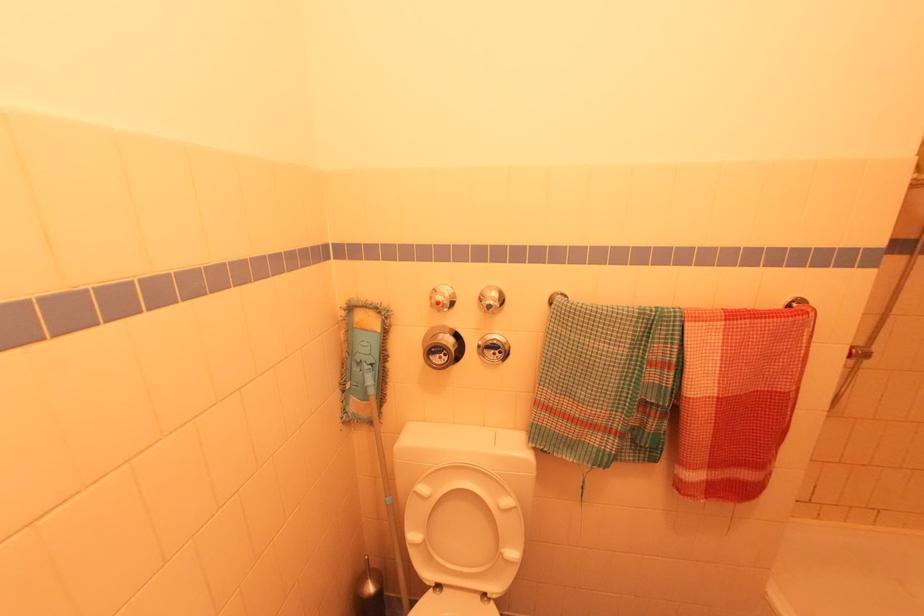
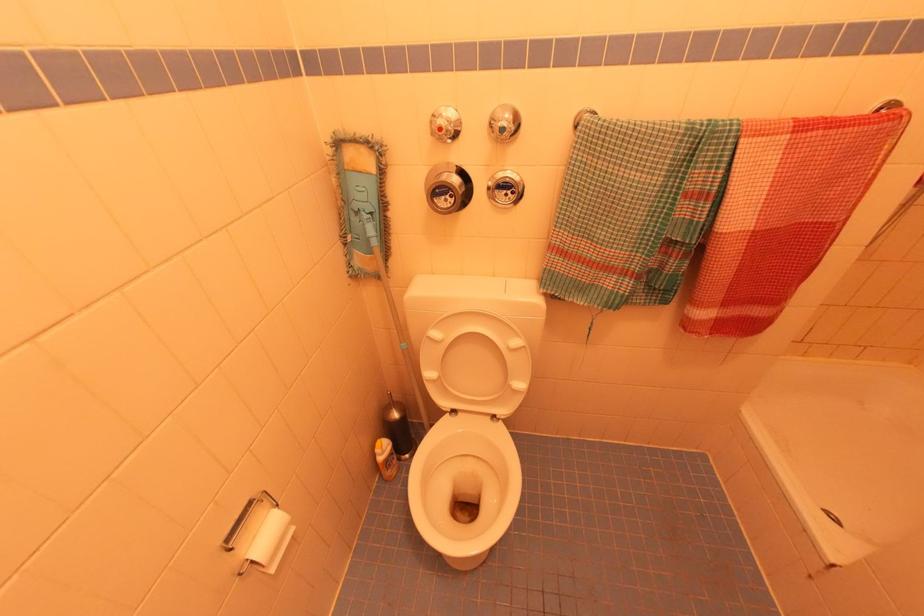
Find the pixel in the second image that matches point 440,357 in the first image.

(444, 198)